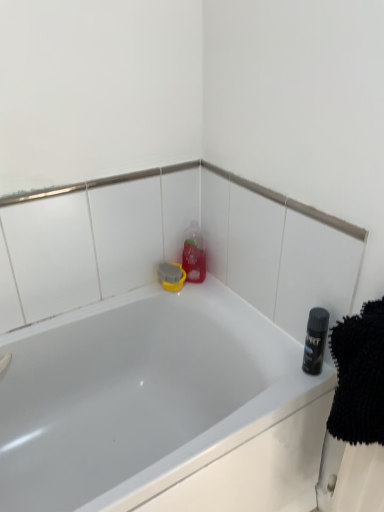
This screenshot has height=512, width=384. What do you see at coordinates (194, 254) in the screenshot? I see `translucent plastic bottle at upper center` at bounding box center [194, 254].

The height and width of the screenshot is (512, 384). I want to click on translucent plastic bottle at upper center, so click(x=194, y=254).

Which is correct: white glossy bathtub at center is inside translucent plastic bottle at upper center, or outside of it?

white glossy bathtub at center is not enclosed by translucent plastic bottle at upper center.

Is the depth of white glossy bathtub at center less than that of translucent plastic bottle at upper center?

Yes, the depth of white glossy bathtub at center is less than that of translucent plastic bottle at upper center.

From a real-world perspective, between white glossy bathtub at center and translucent plastic bottle at upper center, who is vertically higher?

In real-world perspective, translucent plastic bottle at upper center is above.

Considering the relative sizes of white glossy bathtub at center and translucent plastic bottle at upper center in the image provided, is white glossy bathtub at center thinner than translucent plastic bottle at upper center?

In fact, white glossy bathtub at center might be wider than translucent plastic bottle at upper center.

Is point (322, 362) closer to viewer compared to point (33, 486)?

Yes, it is.

Does shiny black can at right have a smaller size compared to white glossy bathtub at center?

Yes.

From a real-world perspective, between shiny black can at right and white glossy bathtub at center, who is vertically lower?

From a 3D spatial view, white glossy bathtub at center is below.

Is shiny black can at right situated inside white glossy bathtub at center or outside?

The correct answer is: outside.

Consider the image. Is translucent plastic bottle at upper center not near white glossy bathtub at center?

That's not correct — translucent plastic bottle at upper center is a little close to white glossy bathtub at center.

Which object is thinner, translucent plastic bottle at upper center or white glossy bathtub at center?

Thinner between the two is translucent plastic bottle at upper center.

From the image's perspective, would you say translucent plastic bottle at upper center is shown under white glossy bathtub at center?

No.

Is translucent plastic bottle at upper center looking in the opposite direction of white glossy bathtub at center?

No.

Is shiny black can at right wider or thinner than translucent plastic bottle at upper center?

Clearly, shiny black can at right has less width compared to translucent plastic bottle at upper center.

Can you tell me how much shiny black can at right and translucent plastic bottle at upper center differ in facing direction?

There is a 90-degree angle between the facing directions of shiny black can at right and translucent plastic bottle at upper center.

From a real-world perspective, is shiny black can at right above or below translucent plastic bottle at upper center?

From a real-world perspective, shiny black can at right is physically below translucent plastic bottle at upper center.

Is shiny black can at right taller or shorter than translucent plastic bottle at upper center?

shiny black can at right is shorter than translucent plastic bottle at upper center.

Based on their positions, is white glossy bathtub at center located to the left or right of shiny black can at right?

Clearly, white glossy bathtub at center is on the left of shiny black can at right in the image.

Is shiny black can at right completely or partially inside white glossy bathtub at center?

No, white glossy bathtub at center does not contain shiny black can at right.

Are white glossy bathtub at center and shiny black can at right located far from each other?

No, there isn't a large distance between white glossy bathtub at center and shiny black can at right.

Which object is closer to the camera taking this photo, white glossy bathtub at center or shiny black can at right?

white glossy bathtub at center is more forward.

Between translucent plastic bottle at upper center and shiny black can at right, which one appears on the right side from the viewer's perspective?

From the viewer's perspective, shiny black can at right appears more on the right side.

Do you think translucent plastic bottle at upper center is within shiny black can at right, or outside of it?

translucent plastic bottle at upper center lies outside shiny black can at right.

The height and width of the screenshot is (512, 384). Identify the location of cleaning product located above the white glossy bathtub at center (from a real-world perspective). (194, 254).

Locate an element on the screen. This screenshot has width=384, height=512. toiletry located behind the white glossy bathtub at center is located at coordinates (315, 340).

Which object lies further to the anchor point shiny black can at right, white glossy bathtub at center or translucent plastic bottle at upper center?

Based on the image, translucent plastic bottle at upper center appears to be further to shiny black can at right.

Based on their spatial positions, is shiny black can at right or translucent plastic bottle at upper center closer to white glossy bathtub at center?

translucent plastic bottle at upper center lies closer to white glossy bathtub at center than the other object.

Estimate the real-world distances between objects in this image. Which object is further from translucent plastic bottle at upper center, white glossy bathtub at center or shiny black can at right?

Based on the image, shiny black can at right appears to be further to translucent plastic bottle at upper center.

When comparing their distances from translucent plastic bottle at upper center, does shiny black can at right or white glossy bathtub at center seem further?

shiny black can at right is positioned further to the anchor translucent plastic bottle at upper center.

From the image, which object appears to be nearer to shiny black can at right, translucent plastic bottle at upper center or white glossy bathtub at center?

white glossy bathtub at center lies closer to shiny black can at right than the other object.

Estimate the real-world distances between objects in this image. Which object is closer to white glossy bathtub at center, translucent plastic bottle at upper center or shiny black can at right?

translucent plastic bottle at upper center lies closer to white glossy bathtub at center than the other object.

The image size is (384, 512). Identify the location of toiletry located between white glossy bathtub at center and translucent plastic bottle at upper center in the depth direction. click(x=315, y=340).